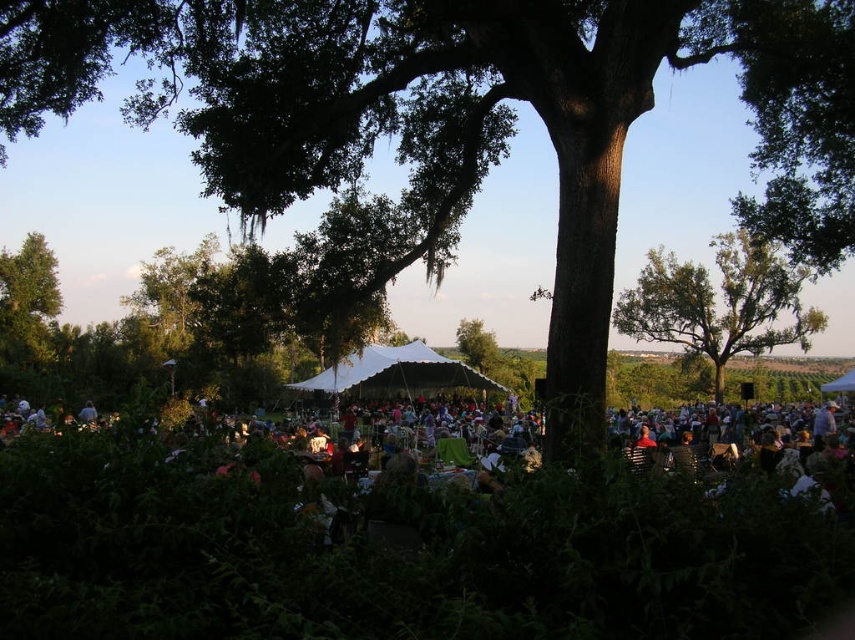
Based on the photo, you are at the outdoor event and want to move from the point marked as point (783, 257) to the point marked as point (317, 387). Considering the dense foliage in the foreground, will your path be obstructed?

Point (783, 257) is behind point (317, 387), so moving from point (783, 257) to point (317, 387) would mean moving towards the foreground. Since the dense foliage is in the foreground, your path would be obstructed by the dense foliage in the foreground.

You are planning to set up a new tent for an event. The current setup has a green leafy tree at upper center and a white fabric canopy at center. How far apart are these two structures?

The distance between the green leafy tree at upper center and the white fabric canopy at center is 57.57 feet.

You are standing in the middle of the event area and looking towards the green leafy tree at left and the green leafy tree at center. Which tree appears closer to you based on their positions?

The green leafy tree at center appears closer because it is positioned below the green leafy tree at left, which is further away.